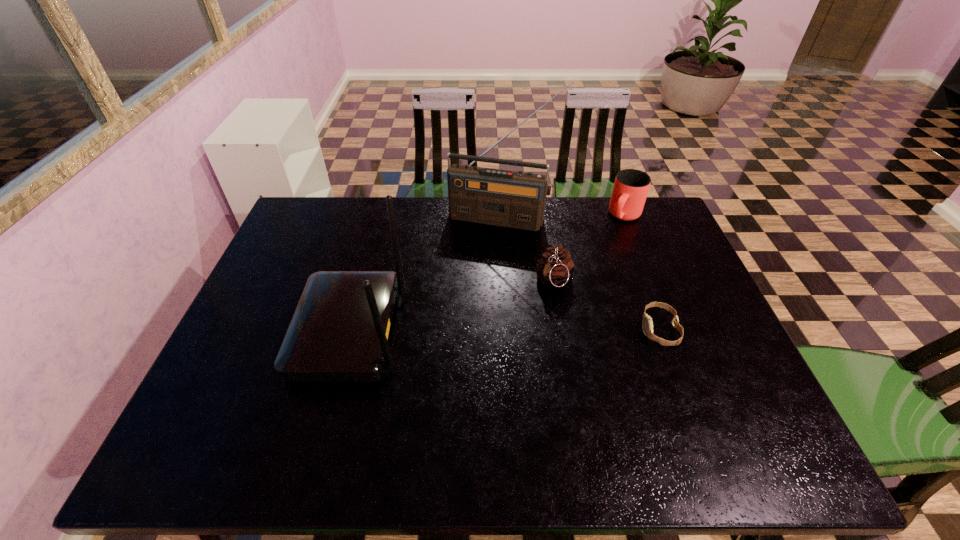
Find the location of `free region located with a leaf charm attached to the pinecone`. free region located with a leaf charm attached to the pinecone is located at coordinates (506, 360).

The height and width of the screenshot is (540, 960). I want to click on cup that is at the far edge, so click(x=631, y=186).

The image size is (960, 540). Find the location of `radio receiver that is positioned at the far edge`. radio receiver that is positioned at the far edge is located at coordinates (505, 198).

Image resolution: width=960 pixels, height=540 pixels. I want to click on object that is at the near edge, so click(339, 332).

Image resolution: width=960 pixels, height=540 pixels. In order to click on object that is positioned at the left edge in this screenshot , I will do `click(339, 332)`.

In order to click on watch at the right edge in this screenshot , I will do (x=647, y=325).

The image size is (960, 540). Find the location of `cup present at the right edge`. cup present at the right edge is located at coordinates (631, 186).

The width and height of the screenshot is (960, 540). I want to click on object that is at the near left corner, so click(339, 332).

I want to click on object located in the far right corner section of the desktop, so click(x=631, y=186).

In the image, there is a desktop. At what (x,y) coordinates should I click in order to perform the action: click on free space at the far edge. Please return your answer as a coordinate pair (x, y). The width and height of the screenshot is (960, 540). Looking at the image, I should click on (447, 220).